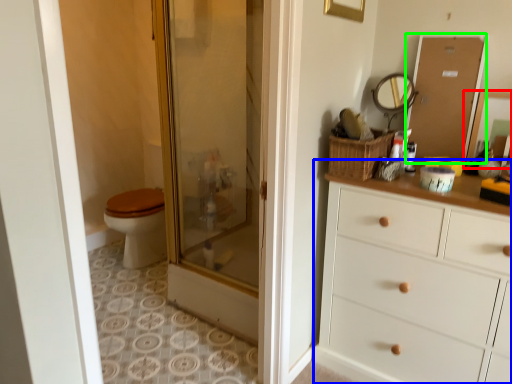
Question: Based on their relative distances, which object is nearer to mirror (highlighted by a red box)? Choose from chest of drawers (highlighted by a blue box) and screen door (highlighted by a green box).

Choices:
 (A) chest of drawers
 (B) screen door

Answer: (B)